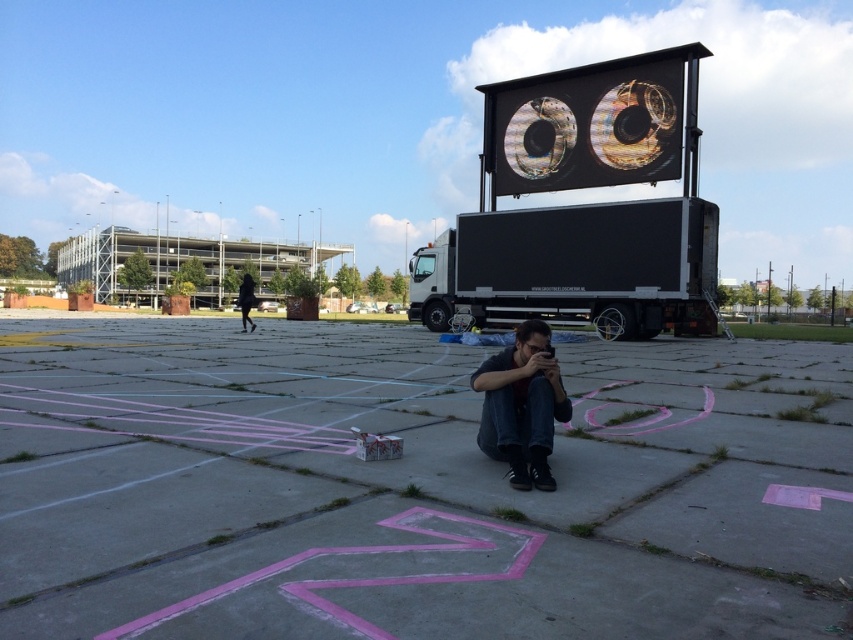
Consider the image. How far apart are concrete at center and black matte trailer truck at center?

concrete at center and black matte trailer truck at center are 25.88 feet apart.

Who is higher up, concrete at center or black matte trailer truck at center?

black matte trailer truck at center

The height and width of the screenshot is (640, 853). Describe the element at coordinates (412, 488) in the screenshot. I see `concrete at center` at that location.

At what (x,y) coordinates should I click in order to perform the action: click on concrete at center. Please return your answer as a coordinate pair (x, y). The height and width of the screenshot is (640, 853). Looking at the image, I should click on [412, 488].

Does concrete at center have a greater height compared to black matte trailer truck at upper center?

No.

Who is more forward, [747,387] or [657,138]?

Point [747,387]

The width and height of the screenshot is (853, 640). Identify the location of concrete at center. (412, 488).

Where is `concrete at center`? concrete at center is located at coordinates (412, 488).

Consider the image. Does black matte trailer truck at upper center have a smaller size compared to black fabric at left?

Incorrect, black matte trailer truck at upper center is not smaller in size than black fabric at left.

Identify the location of black matte trailer truck at upper center. This screenshot has width=853, height=640. (583, 208).

Between point (519, 256) and point (242, 326), which one is positioned in front?

Point (519, 256) is in front.

You are a GUI agent. You are given a task and a screenshot of the screen. Output one action in this format:
    pyautogui.click(x=<x>, y=<y>)
    Task: Click on the black matte trailer truck at upper center
    This screenshot has height=640, width=853.
    Given the screenshot: What is the action you would take?
    (x=583, y=208)